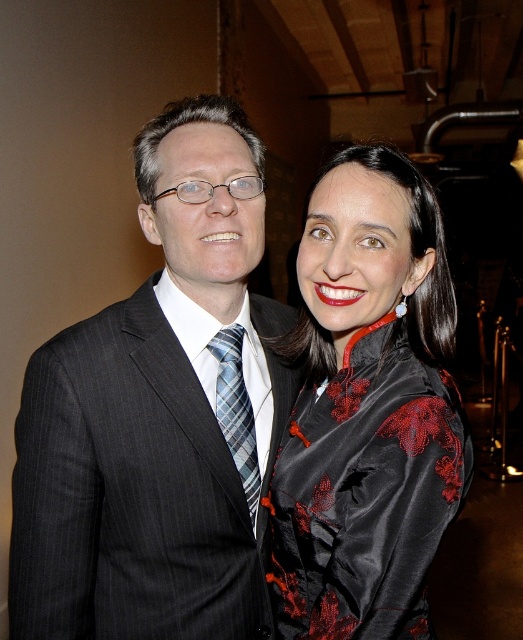
Can you confirm if satin black dress at center is bigger than plaid silk tie at center?

Correct, satin black dress at center is larger in size than plaid silk tie at center.

Is satin black dress at center below plaid silk tie at center?

Incorrect, satin black dress at center is not positioned below plaid silk tie at center.

This screenshot has width=523, height=640. Find the location of `satin black dress at center`. satin black dress at center is located at coordinates (368, 410).

Locate an element on the screen. The width and height of the screenshot is (523, 640). satin black dress at center is located at coordinates (368, 410).

Who is more forward, (186, 392) or (238, 419)?

Positioned in front is point (186, 392).

Is matte black suit at left bigger than plaid silk tie at center?

Yes.

Is point (169, 128) positioned behind point (244, 426)?

No, (169, 128) is in front of (244, 426).

This screenshot has height=640, width=523. I want to click on matte black suit at left, so click(x=158, y=413).

Between matte black suit at left and satin black dress at center, which one is positioned higher?

Positioned higher is matte black suit at left.

Where is `matte black suit at left`? This screenshot has height=640, width=523. matte black suit at left is located at coordinates (158, 413).